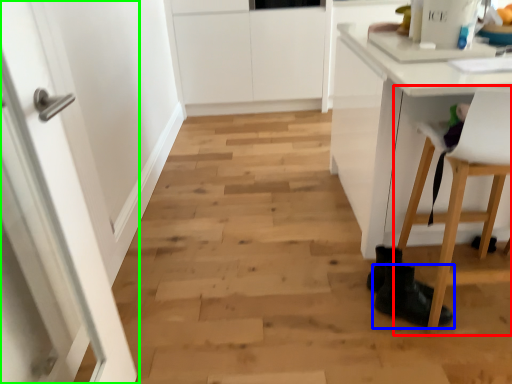
Question: Which object is positioned closest to chair (highlighted by a red box)? Select from footwear (highlighted by a blue box) and door (highlighted by a green box).

Choices:
 (A) footwear
 (B) door

Answer: (A)